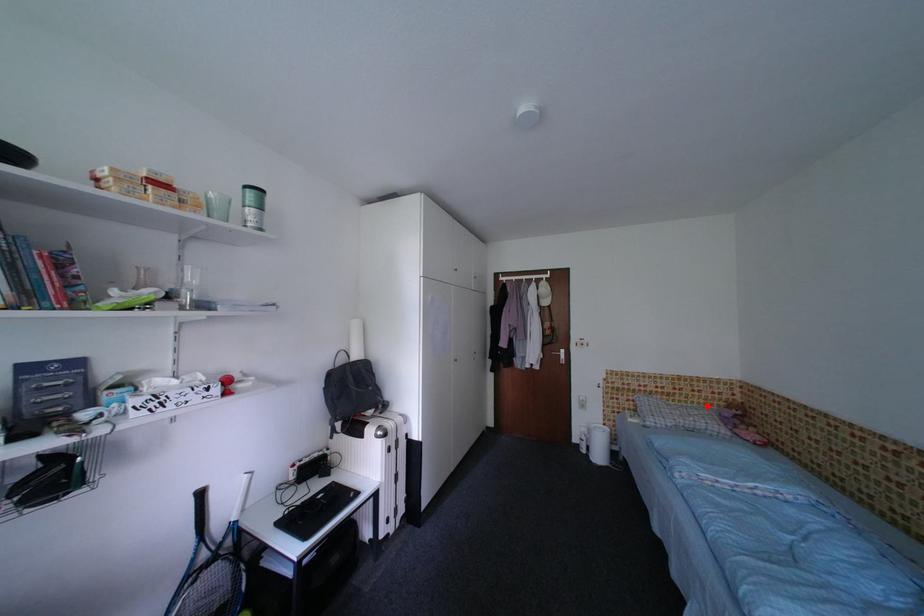
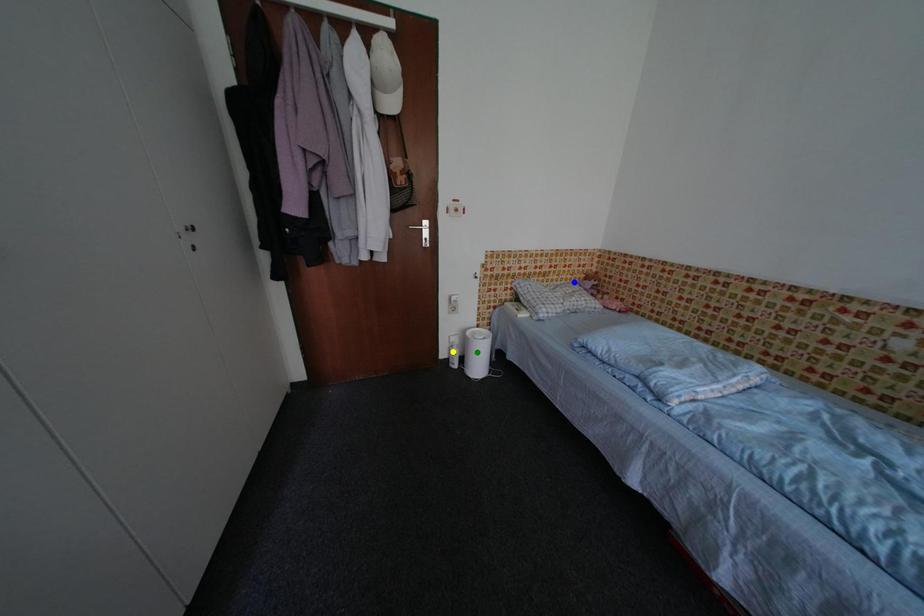
Question: I am providing you with two images of the same scene from different viewpoints. A red point is marked on the first image. You are given multiple points on the second image. Which point in image 2 is actually the same real-world point as the red point in image 1?

Choices:
 (A) green point
 (B) yellow point
 (C) blue point

Answer: (C)